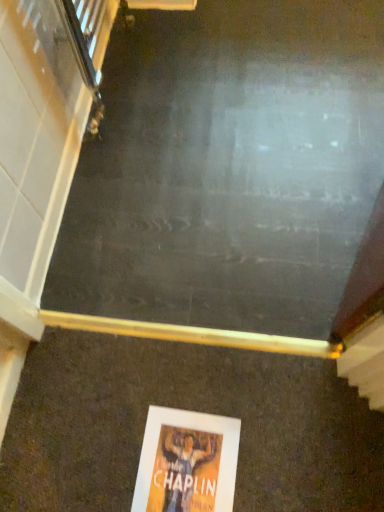
Question: Should I look upward or downward to see orange paper poster at lower center?

Choices:
 (A) up
 (B) down

Answer: (B)